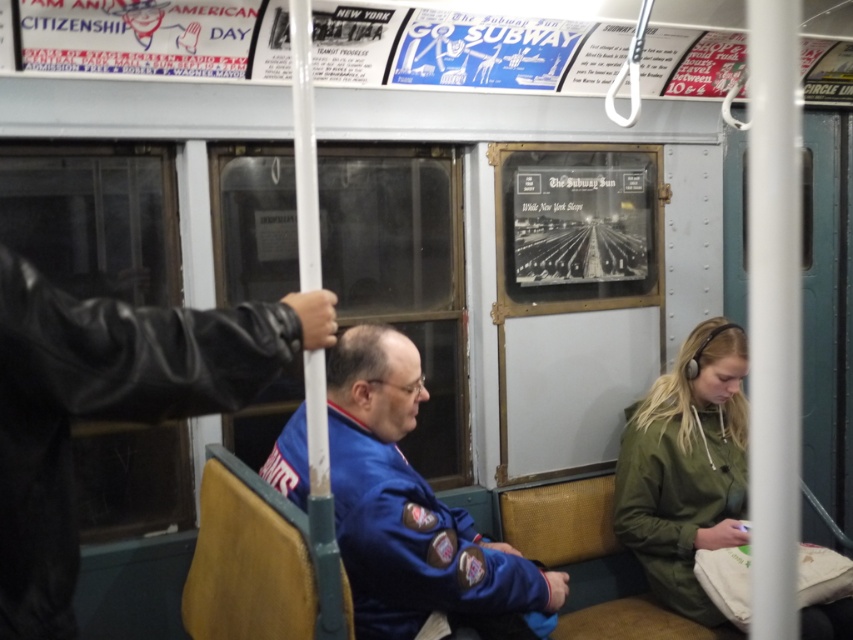
Question: Does leather jacket at left appear on the left side of blue fabric jacket at center?

Choices:
 (A) no
 (B) yes

Answer: (B)

Question: Is blue fabric jacket at center wider than green matte jacket at lower right?

Choices:
 (A) no
 (B) yes

Answer: (B)

Question: Is leather jacket at left to the right of blue fabric jacket at center from the viewer's perspective?

Choices:
 (A) no
 (B) yes

Answer: (A)

Question: Which of these objects is positioned closest to the blue fabric jacket at center?

Choices:
 (A) leather jacket at left
 (B) green matte jacket at lower right

Answer: (A)

Question: Which of the following is the closest to the observer?

Choices:
 (A) blue fabric jacket at center
 (B) green matte jacket at lower right

Answer: (A)

Question: Which of the following is the farthest from the observer?

Choices:
 (A) (7, 342)
 (B) (486, 580)
 (C) (688, 605)

Answer: (C)